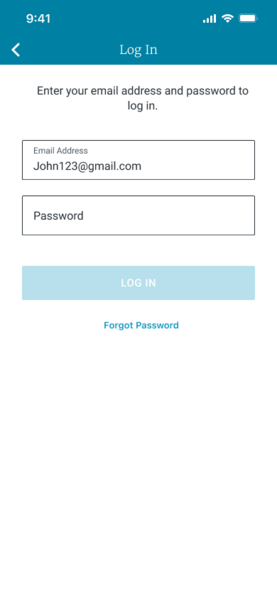
Where is `wifi`? The width and height of the screenshot is (277, 600). wifi is located at coordinates (228, 17).